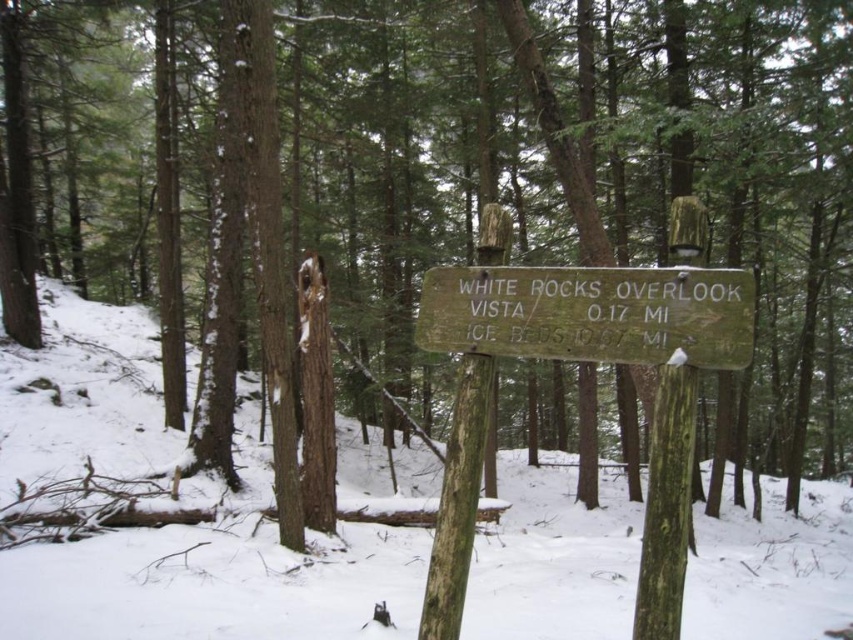
Does white matte snow at center come behind weathered wood sign at center?

Yes, white matte snow at center is further from the viewer.

Which is in front, point (38, 456) or point (743, 332)?

Point (743, 332) is in front.

Identify the location of white matte snow at center. (215, 584).